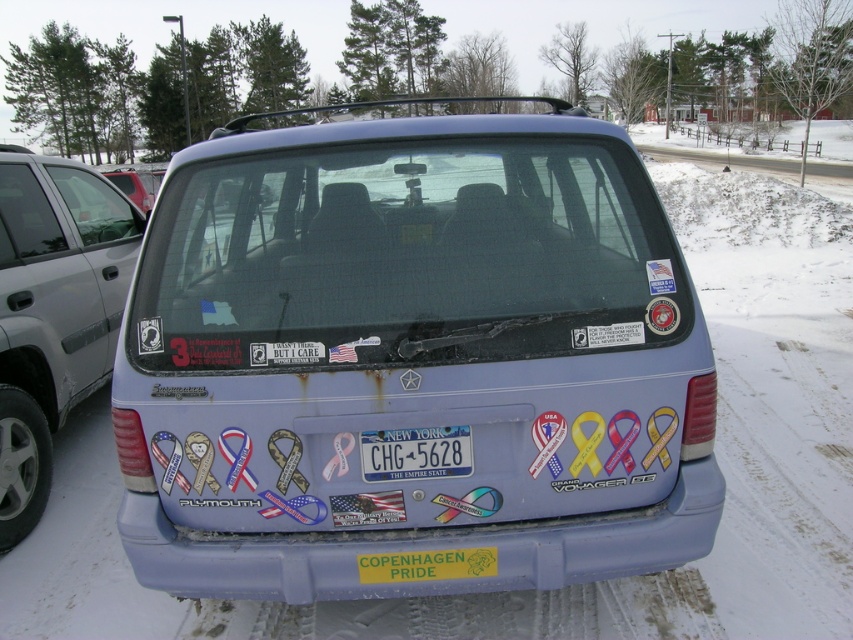
The height and width of the screenshot is (640, 853). Find the location of `matte blue van at center`. matte blue van at center is located at coordinates (410, 362).

Does point (287, 500) come in front of point (74, 260)?

Yes, point (287, 500) is in front of point (74, 260).

Is point (650, 218) in front of point (96, 230)?

Yes, point (650, 218) is in front of point (96, 230).

Find the location of a particular element. The width and height of the screenshot is (853, 640). matte blue van at center is located at coordinates (410, 362).

The height and width of the screenshot is (640, 853). Describe the element at coordinates (410, 362) in the screenshot. I see `matte blue van at center` at that location.

Who is positioned more to the right, matte blue van at center or matte black van at center?

matte blue van at center is more to the right.

Measure the distance between point (558, 163) and camera.

The distance of point (558, 163) from camera is 9.28 feet.

Where is `matte blue van at center`? matte blue van at center is located at coordinates (410, 362).

Does matte blue minivan at center have a greater width compared to blue plastic license plate at center?

Correct, the width of matte blue minivan at center exceeds that of blue plastic license plate at center.

Which is below, matte blue minivan at center or blue plastic license plate at center?

Positioned lower is blue plastic license plate at center.

Who is more forward, (91, 298) or (432, 476)?

Point (432, 476)

Locate an element on the screen. matte blue minivan at center is located at coordinates (53, 310).